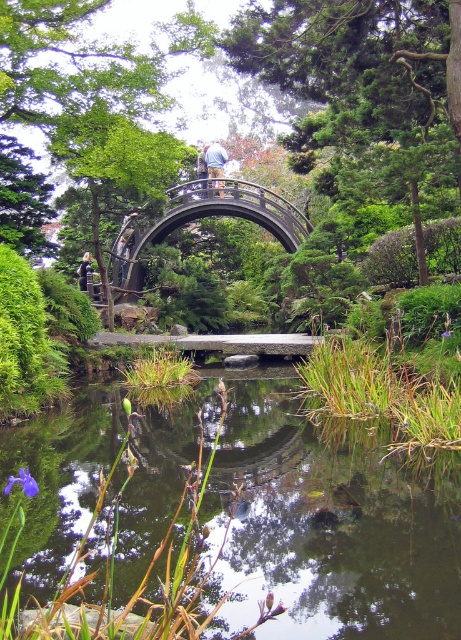
You are a visitor in the garden and want to cross the dark brown wooden bridge at center to reach the other side. However, you notice the green grassy water at center underneath it. Is the bridge safe to walk on?

The green grassy water at center is positioned under the dark brown wooden bridge at center, so the bridge is elevated above the water and should be safe to walk on.